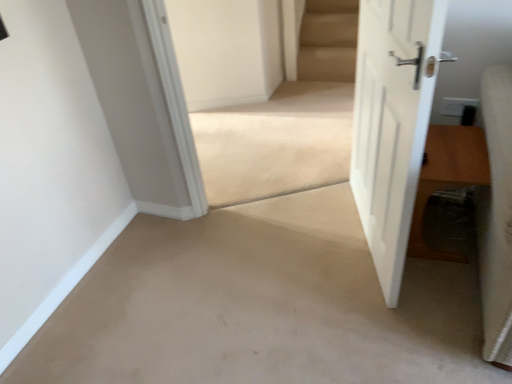
Question: Would you say white matte door at right is to the left or to the right of brown wooden table at right in the picture?

Choices:
 (A) left
 (B) right

Answer: (A)

Question: Is white matte door at right taller or shorter than brown wooden table at right?

Choices:
 (A) tall
 (B) short

Answer: (A)

Question: Considering the real-world distances, which object is farthest from the beige carpet at center?

Choices:
 (A) white matte door at right
 (B) brown wooden table at right

Answer: (B)

Question: Which of these objects is positioned closest to the white matte door at right?

Choices:
 (A) brown wooden table at right
 (B) beige carpet at center

Answer: (A)